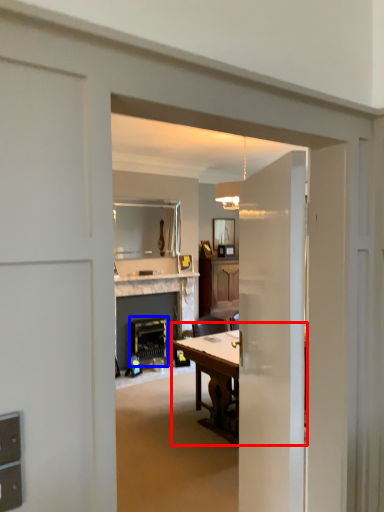
Question: Which of the following is the closest to the observer, table (highlighted by a red box) or appliance (highlighted by a blue box)?

Choices:
 (A) table
 (B) appliance

Answer: (A)